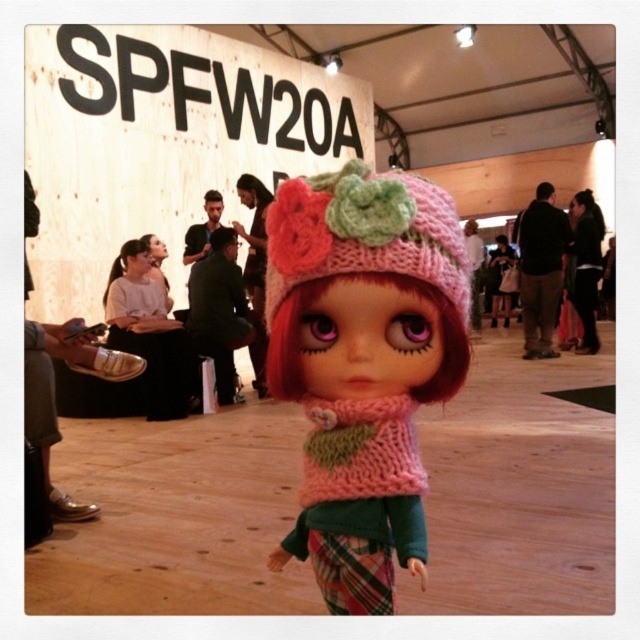
Which is more to the left, knitted pink hat at center or pink knitted hat at center?

knitted pink hat at center

Does point (406, 250) come farther from viewer compared to point (456, 224)?

That is False.

What are the coordinates of `knitted pink hat at center` in the screenshot? It's located at (362, 364).